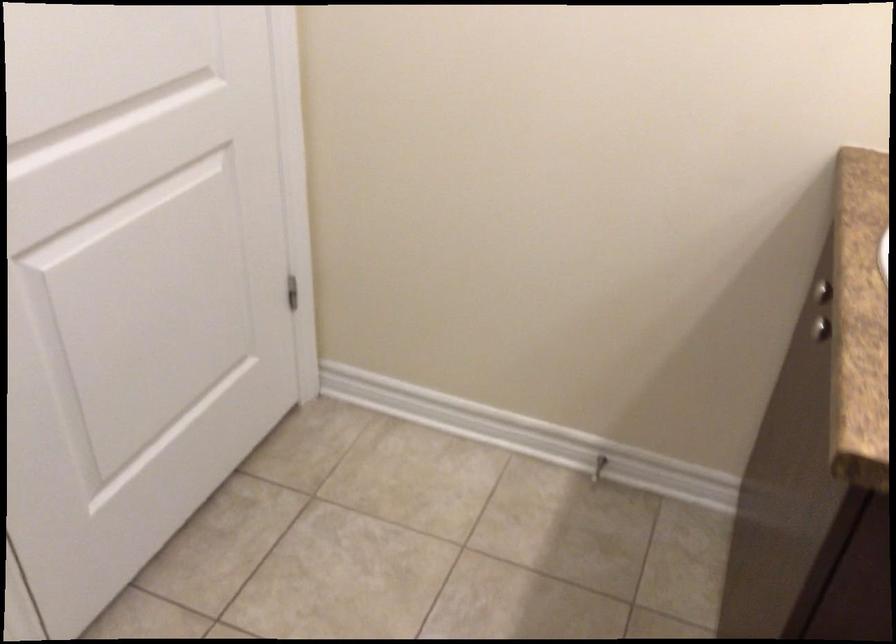
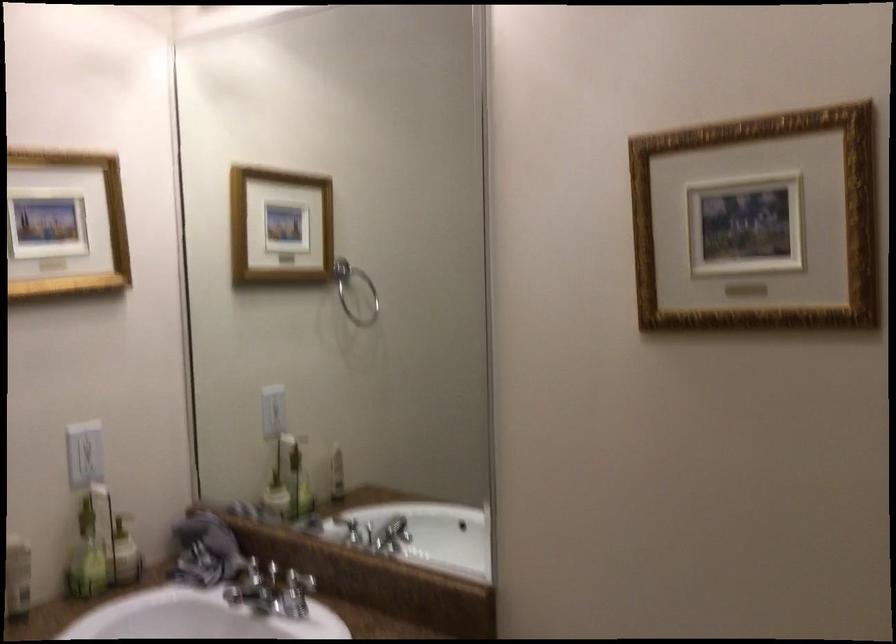
Question: The camera is either moving clockwise (left) or counter-clockwise (right) around the object. The first image is from the beginning of the video and the second image is from the end. Is the camera moving left or right when shooting the video?

Choices:
 (A) Left
 (B) Right

Answer: (A)